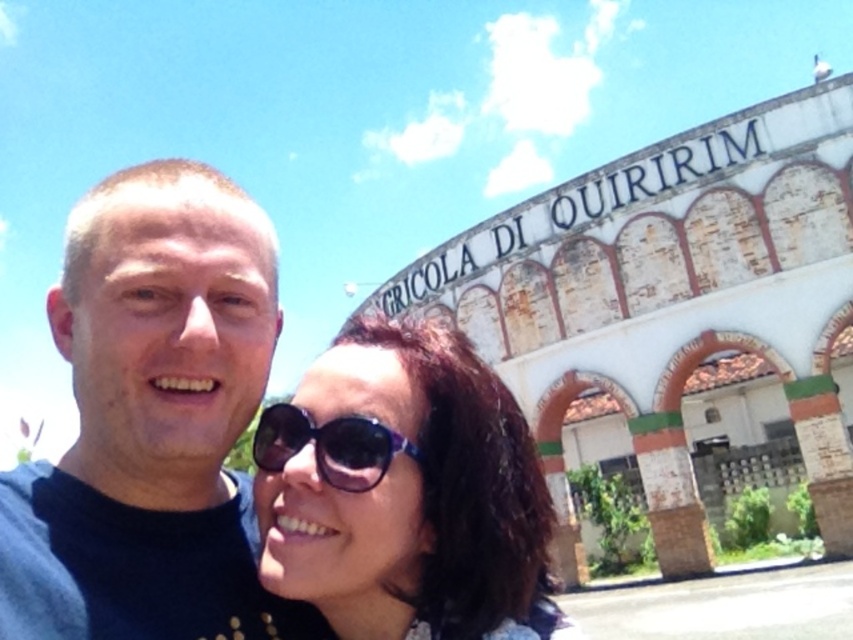
You are a photographer taking a picture of the black matte shirt at center and the transparent plastic sunglasses at center. Which object is positioned higher in the image?

The black matte shirt at center is located above the transparent plastic sunglasses at center, so it is positioned higher in the image.